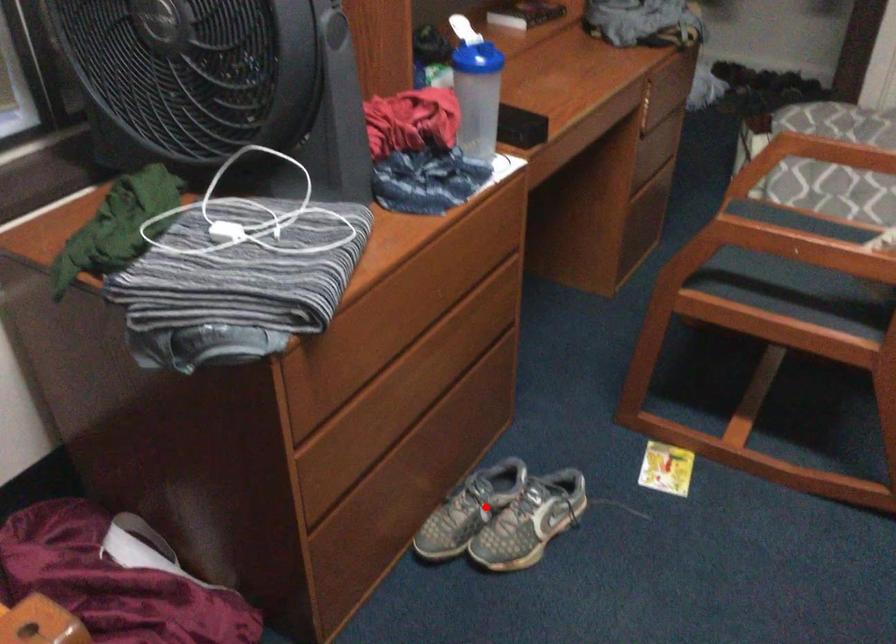
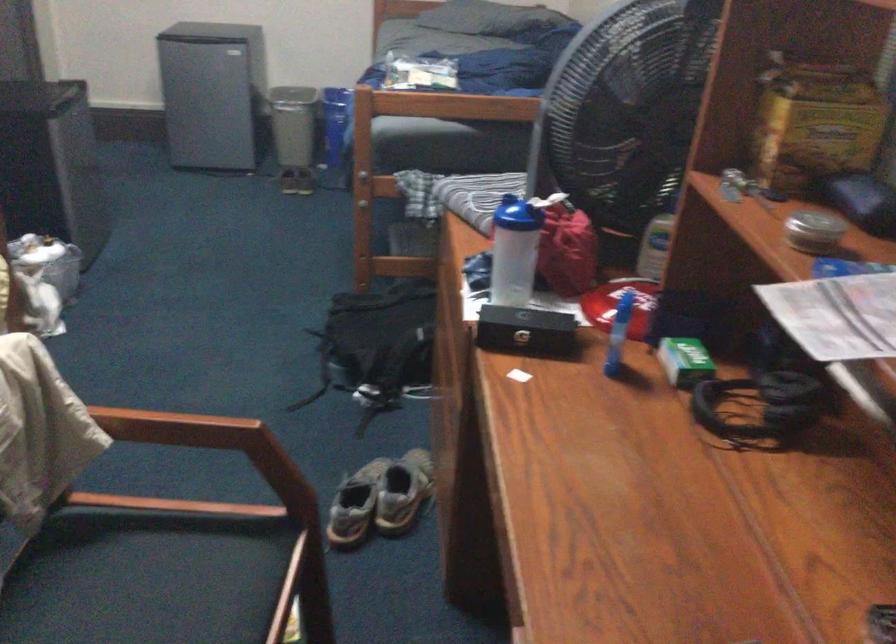
Locate, in the second image, the point that corresponds to the highlighted location in the first image.

(402, 491)